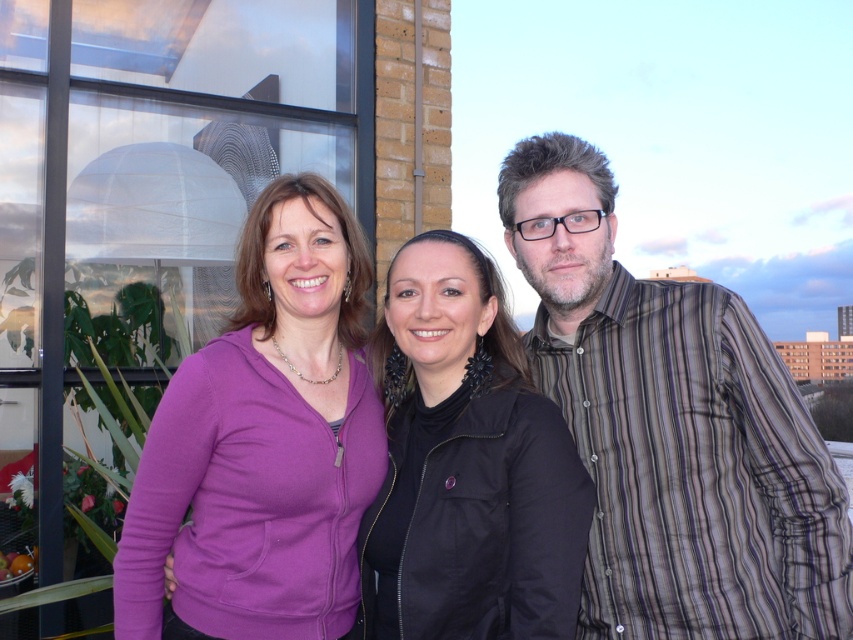
Is purple fleece jacket at center below black fabric jacket at center?

Actually, purple fleece jacket at center is above black fabric jacket at center.

Which is behind, point (161, 484) or point (438, 243)?

The point (438, 243) is behind.

Is point (283, 493) less distant than point (386, 298)?

Yes, it is in front of point (386, 298).

Where is `purple fleece jacket at center`? purple fleece jacket at center is located at coordinates (264, 442).

Is striped cotton shirt at right further to camera compared to purple fleece jacket at center?

No, it is not.

Who is taller, striped cotton shirt at right or purple fleece jacket at center?

Standing taller between the two is striped cotton shirt at right.

The image size is (853, 640). In order to click on striped cotton shirt at right in this screenshot , I will do `click(672, 428)`.

Measure the distance from striped cotton shirt at right to black fabric jacket at center.

striped cotton shirt at right and black fabric jacket at center are 11.24 inches apart from each other.

Locate an element on the screen. striped cotton shirt at right is located at coordinates (672, 428).